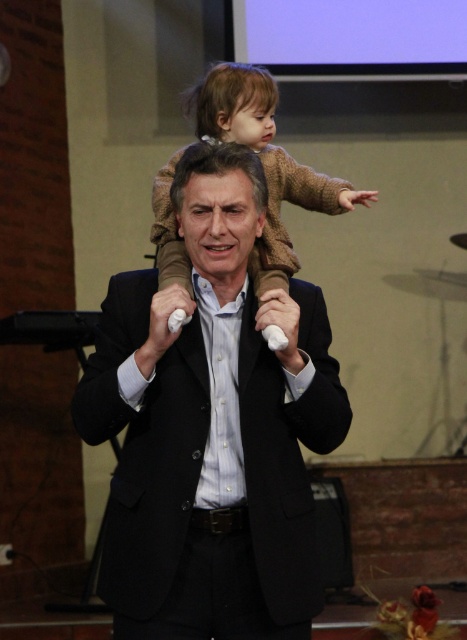
You are an event planner organizing a photo shoot in this space. You need to position a spotlight so that it illuminates both the matte black suit at center and the light brown wool sweater at upper center without casting shadows on the large screen at the top right. Given their positions, which object should the spotlight be aimed at first to ensure both are lit properly?

The spotlight should be aimed at the matte black suit at center first since it is in front of the light brown wool sweater at upper center. By lighting the front object first, you can adjust the angle to also illuminate the one behind without blocking the light onto the screen.

You are a photographer trying to capture a candid shot of the matte black suit at center and the light brown wool sweater at upper center. Which object should you focus on first if you want to ensure both are in sharp focus?

The matte black suit at center is positioned under light brown wool sweater at upper center, so focusing on the light brown wool sweater at upper center first would ensure both are in focus since it is closer to the camera.

You are attending a family gathering and want to take a photo of the matte black suit at center and the light brown wool sweater at upper center. Which one should you focus on first if you want to capture both in a single shot without moving the camera?

The matte black suit at center is to the left of the light brown wool sweater at upper center, so you should focus on the matte black suit at center first as it is positioned to the left, allowing both subjects to be captured in the frame without moving the camera.